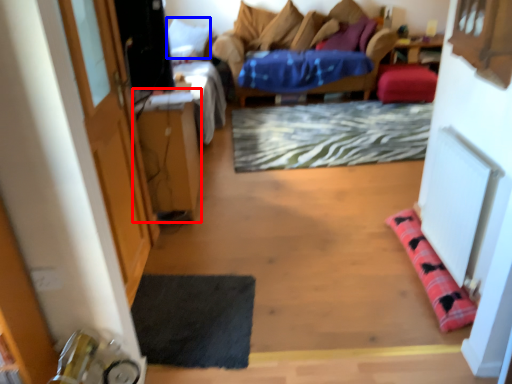
Question: Among these objects, which one is nearest to the camera, table (highlighted by a red box) or pillow (highlighted by a blue box)?

Choices:
 (A) table
 (B) pillow

Answer: (A)